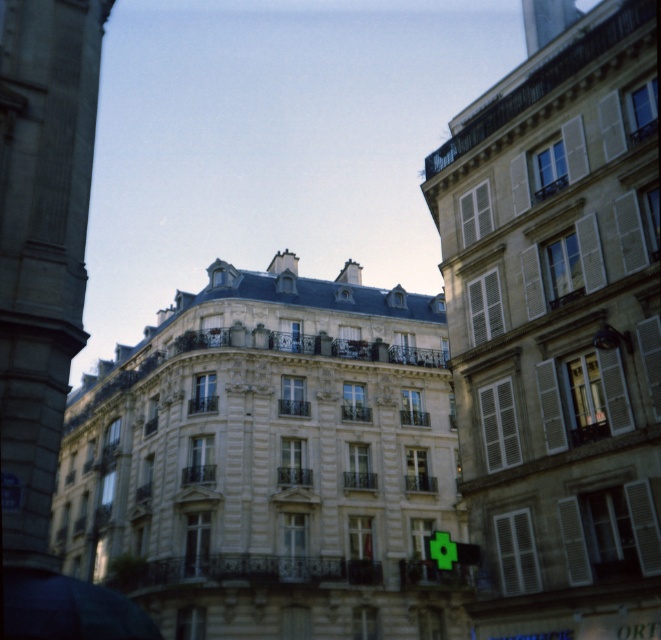
Is dark blue fabric umbrella at lower left thinner than metallic silver tower at upper right?

Incorrect, dark blue fabric umbrella at lower left's width is not less than metallic silver tower at upper right's.

Does dark blue fabric umbrella at lower left have a greater width compared to metallic silver tower at upper right?

Yes, dark blue fabric umbrella at lower left is wider than metallic silver tower at upper right.

Which is behind, point (139, 612) or point (559, 26)?

The point (559, 26) is more distant.

At what (x,y) coordinates should I click in order to perform the action: click on dark blue fabric umbrella at lower left. Please return your answer as a coordinate pair (x, y). The height and width of the screenshot is (640, 661). Looking at the image, I should click on (67, 609).

Measure the distance between point (578, 380) and camera.

They are 39.61 meters apart.

Between smooth beige building at center and smooth stone tower at left, which one is positioned higher?

smooth stone tower at left is above.

What do you see at coordinates (559, 330) in the screenshot?
I see `smooth beige building at center` at bounding box center [559, 330].

Find the location of a particular element. smooth beige building at center is located at coordinates (559, 330).

Is point (631, 308) positioned after point (17, 627)?

Yes, point (631, 308) is behind point (17, 627).

Can you confirm if smooth beige building at center is positioned above dark blue fabric umbrella at lower left?

Yes.

Find the location of a particular element. smooth beige building at center is located at coordinates (559, 330).